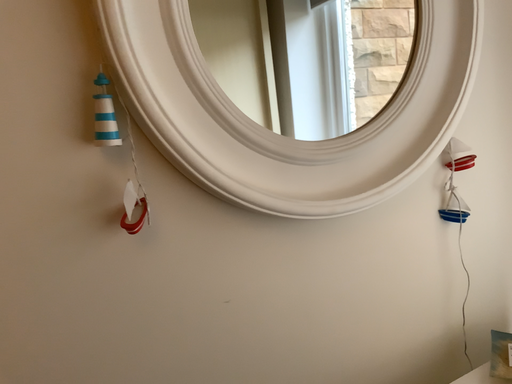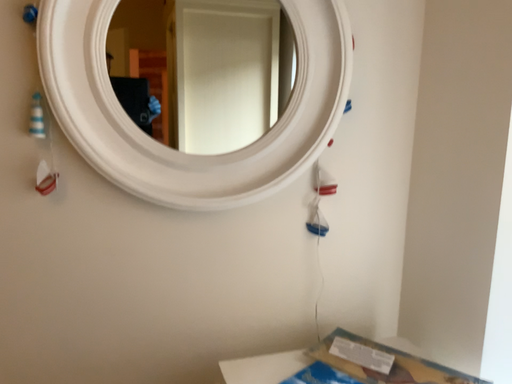
Question: Which way did the camera rotate in the video?

Choices:
 (A) rotated right
 (B) rotated left

Answer: (B)